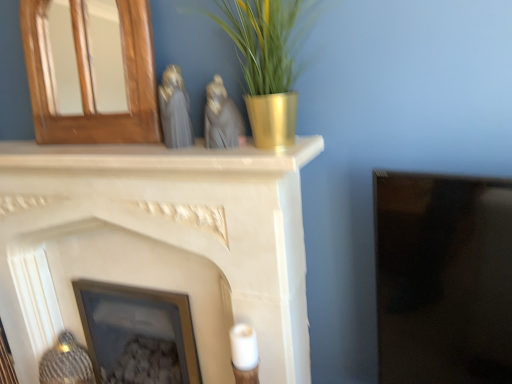
Image resolution: width=512 pixels, height=384 pixels. What are the coordinates of `free point in front of satin gray statue at center, which appears as the 2th animal when viewed from the right` in the screenshot? It's located at (187, 147).